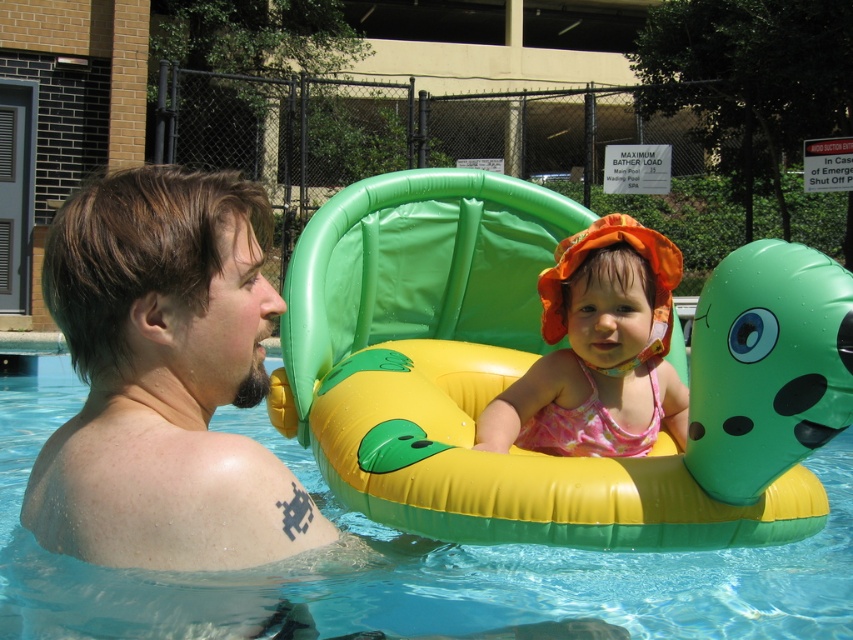
Does yellow rubber float at center appear under smooth skin man at left?

Yes, yellow rubber float at center is below smooth skin man at left.

Consider the image. Between yellow rubber float at center and smooth skin man at left, which one is positioned higher?

Positioned higher is smooth skin man at left.

The width and height of the screenshot is (853, 640). Find the location of `yellow rubber float at center`. yellow rubber float at center is located at coordinates (537, 358).

Who is taller, smooth skin man at left or pink fabric swimsuit at center?

Standing taller between the two is pink fabric swimsuit at center.

Does smooth skin man at left have a lesser width compared to pink fabric swimsuit at center?

Indeed, smooth skin man at left has a lesser width compared to pink fabric swimsuit at center.

This screenshot has width=853, height=640. Find the location of `smooth skin man at left`. smooth skin man at left is located at coordinates (164, 380).

Is smooth skin man at left to the right of transparent yellow-green float at center from the viewer's perspective?

In fact, smooth skin man at left is to the left of transparent yellow-green float at center.

Which is below, smooth skin man at left or transparent yellow-green float at center?

Positioned lower is transparent yellow-green float at center.

Is point (221, 259) behind point (15, 444)?

That is False.

I want to click on smooth skin man at left, so click(164, 380).